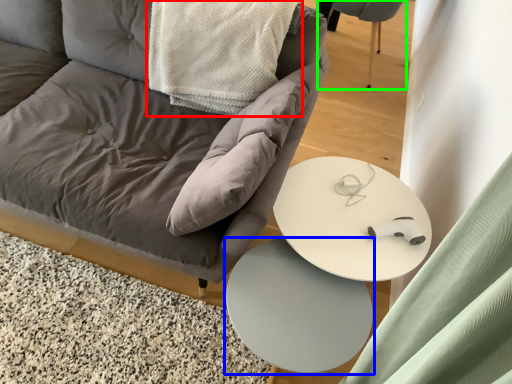
Question: Which object is the closest to the material (highlighted by a red box)? Choose among these: table (highlighted by a blue box) or swivel chair (highlighted by a green box).

Choices:
 (A) table
 (B) swivel chair

Answer: (A)